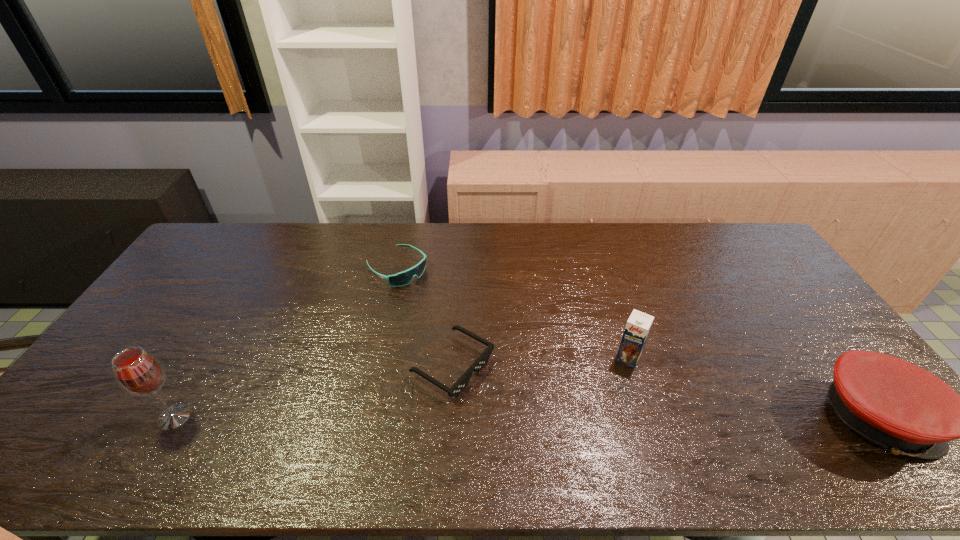
Where is `free space on the desktop that is between the leftmost object and the rightmost object and is positioned on the front-facing side of the second shortest object`? free space on the desktop that is between the leftmost object and the rightmost object and is positioned on the front-facing side of the second shortest object is located at coordinates (588, 417).

This screenshot has width=960, height=540. I want to click on vacant space on the desktop that is between the tallest object and the third tallest object and is positioned on the front-facing side of the nearer sunglasses, so click(x=540, y=417).

Locate an element on the screen. free space on the desktop that is between the leftmost object and the cap and is positioned on the front label of the chocolate milk is located at coordinates point(598,417).